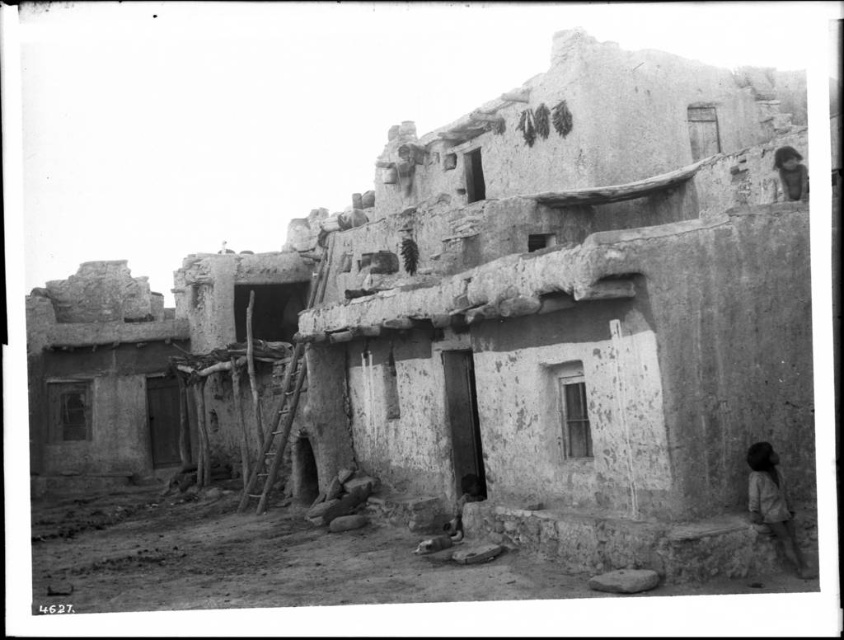
Does wooden ladder at center-left appear under wooden rustic ladder at center?

Actually, wooden ladder at center-left is above wooden rustic ladder at center.

Find the location of `wooden ladder at center-left`. wooden ladder at center-left is located at coordinates (276, 433).

Between point (258, 464) and point (289, 428), which one is positioned in front?

Positioned in front is point (289, 428).

This screenshot has width=844, height=640. Find the location of `wooden ladder at center-left`. wooden ladder at center-left is located at coordinates (276, 433).

Can you confirm if brown textured cloth at lower right is positioned to the left of dark brown leather hat at upper right?

Correct, you'll find brown textured cloth at lower right to the left of dark brown leather hat at upper right.

Can you confirm if brown textured cloth at lower right is positioned below dark brown leather hat at upper right?

Correct, brown textured cloth at lower right is located below dark brown leather hat at upper right.

Measure the distance between brown textured cloth at lower right and camera.

brown textured cloth at lower right is 35.59 meters away from camera.

Locate an element on the screen. brown textured cloth at lower right is located at coordinates (772, 504).

Does point (112, 340) lie behind point (269, 433)?

Yes, it is behind point (269, 433).

What do you see at coordinates (101, 372) in the screenshot? The height and width of the screenshot is (640, 844). I see `smooth adobe hut at left` at bounding box center [101, 372].

Where is `smooth adobe hut at left`? Image resolution: width=844 pixels, height=640 pixels. smooth adobe hut at left is located at coordinates (101, 372).